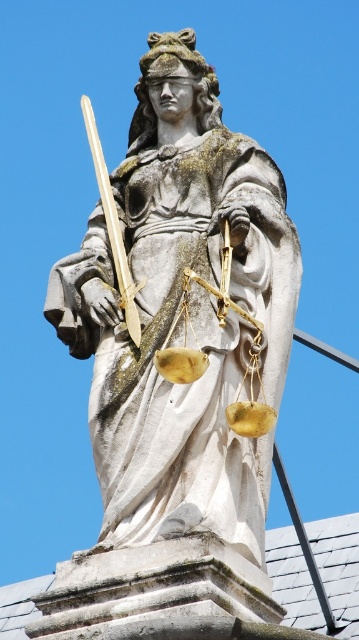
Where is `white stone statue at center`? The width and height of the screenshot is (359, 640). white stone statue at center is located at coordinates (175, 308).

Is white stone statue at center bigger than polished gold sword at upper center?

No, white stone statue at center is not bigger than polished gold sword at upper center.

Between point (218, 458) and point (92, 120), which one is positioned behind?

Point (92, 120)

You are a GUI agent. You are given a task and a screenshot of the screen. Output one action in this format:
    pyautogui.click(x=<x>, y=<y>)
    Task: Click on the white stone statue at center
    
    Given the screenshot: What is the action you would take?
    pyautogui.click(x=175, y=308)